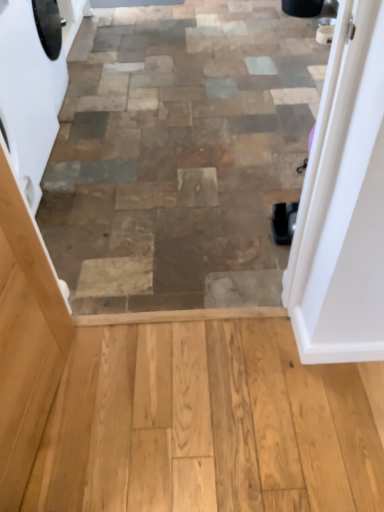
Question: Is white glossy washing machine at left shorter than white glossy door at upper right?

Choices:
 (A) no
 (B) yes

Answer: (B)

Question: Can you confirm if white glossy washing machine at left is wider than white glossy door at upper right?

Choices:
 (A) yes
 (B) no

Answer: (A)

Question: Is white glossy washing machine at left at the left side of white glossy door at upper right?

Choices:
 (A) no
 (B) yes

Answer: (B)

Question: From a real-world perspective, is white glossy washing machine at left over white glossy door at upper right?

Choices:
 (A) no
 (B) yes

Answer: (A)

Question: Can you confirm if white glossy washing machine at left is smaller than white glossy door at upper right?

Choices:
 (A) yes
 (B) no

Answer: (B)

Question: From a real-world perspective, relative to white glossy door at upper right, is white glossy washing machine at left vertically above or below?

Choices:
 (A) above
 (B) below

Answer: (B)

Question: Looking at their shapes, would you say white glossy washing machine at left is wider or thinner than white glossy door at upper right?

Choices:
 (A) wide
 (B) thin

Answer: (A)

Question: Is point (51, 65) positioned closer to the camera than point (304, 275)?

Choices:
 (A) closer
 (B) farther

Answer: (B)

Question: In terms of size, does white glossy washing machine at left appear bigger or smaller than white glossy door at upper right?

Choices:
 (A) small
 (B) big

Answer: (B)

Question: From a real-world perspective, is light brown wood screen door at left positioned above or below white glossy door at upper right?

Choices:
 (A) below
 (B) above

Answer: (A)

Question: Based on their sizes in the image, would you say light brown wood screen door at left is bigger or smaller than white glossy door at upper right?

Choices:
 (A) small
 (B) big

Answer: (B)

Question: From their relative heights in the image, would you say light brown wood screen door at left is taller or shorter than white glossy door at upper right?

Choices:
 (A) short
 (B) tall

Answer: (A)

Question: Does point (9, 382) appear closer or farther from the camera than point (324, 281)?

Choices:
 (A) closer
 (B) farther

Answer: (A)

Question: From the image's perspective, is light brown wood screen door at left above or below white glossy washing machine at left?

Choices:
 (A) above
 (B) below

Answer: (B)

Question: Is light brown wood screen door at left bigger or smaller than white glossy washing machine at left?

Choices:
 (A) small
 (B) big

Answer: (A)